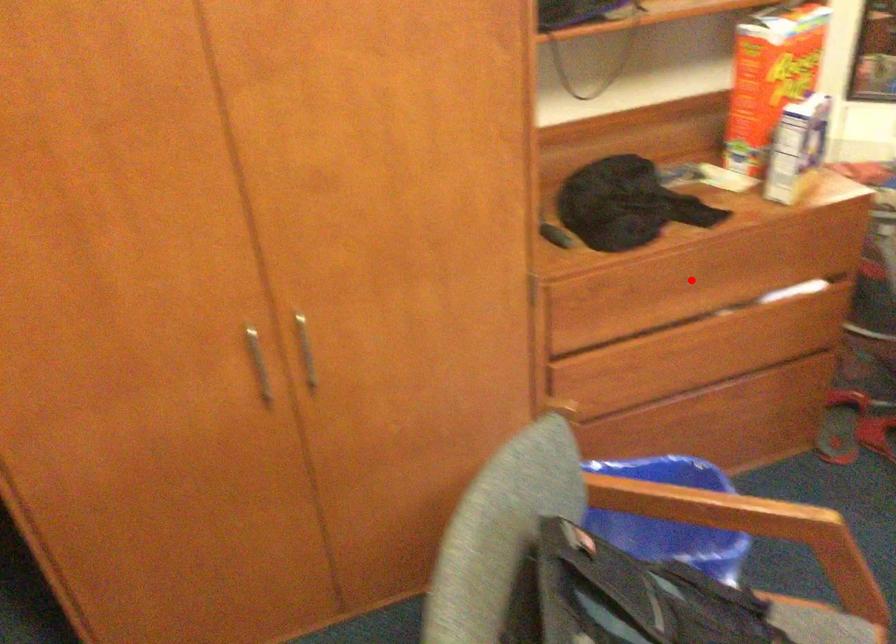
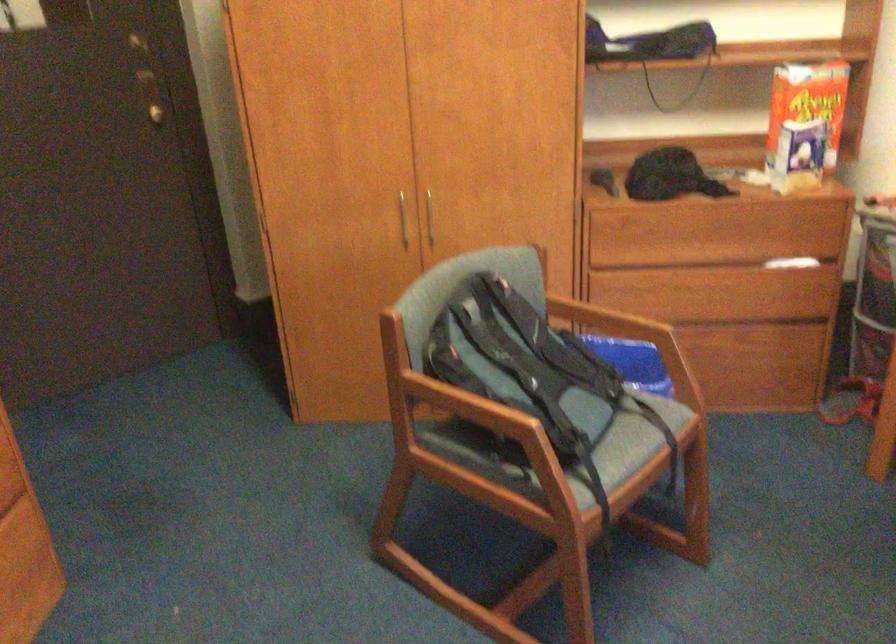
Question: I am providing you with two images of the same scene from different viewpoints. A red point is shown in image1. For the corresponding object point in image2, is it positioned nearer or farther from the camera?

Choices:
 (A) Nearer
 (B) Farther

Answer: (B)